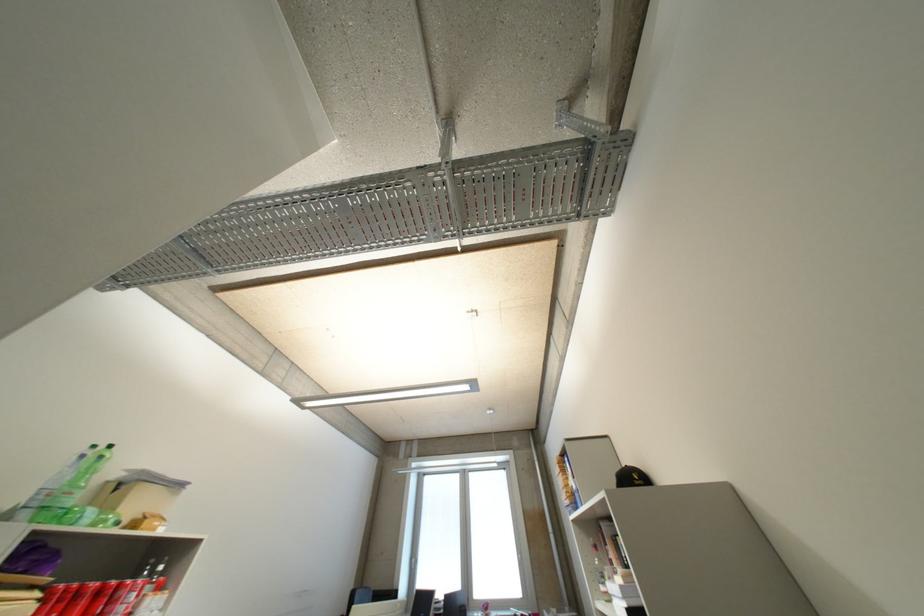
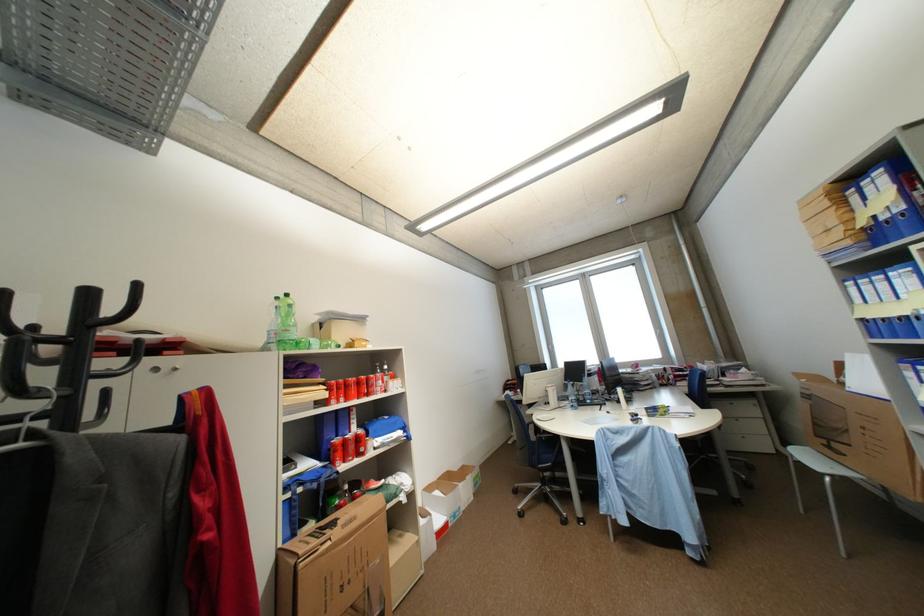
The images are taken continuously from a first-person perspective. In which direction is your viewpoint rotating?

The camera rotated toward left-down.